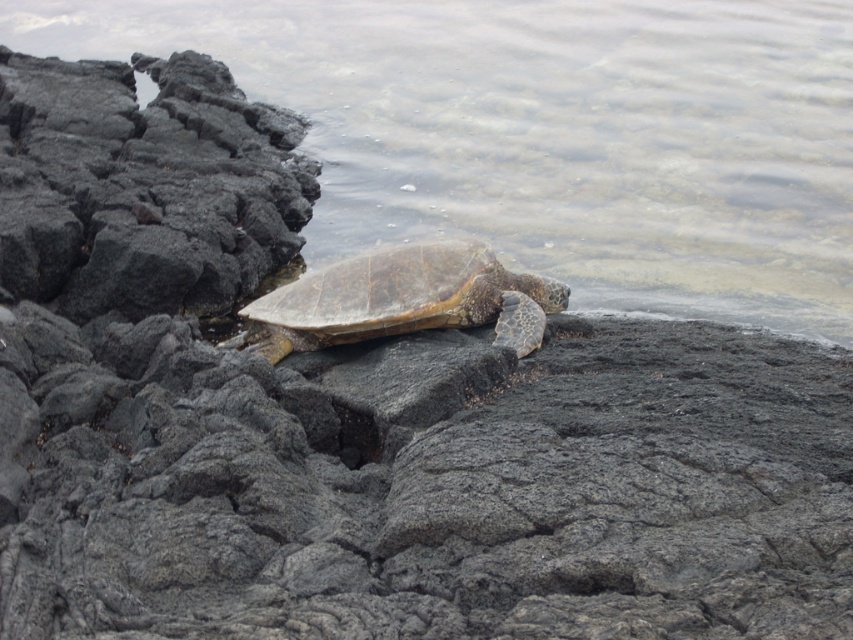
You are a small frog trying to jump from the brown textured shell at center to the clear water at upper center. Can you safely make the jump without getting wet?

The clear water at upper center might be wider than the brown textured shell at center, so the distance between them could be too large for the frog to jump safely. It might need to find a closer spot to jump from.

You are navigating a small drone that can only move forward and backward along a straight path. You need to fly from point A to point B. If point A is at point [606,49] and point B is at point [430,317], will you pass over the turtle resting on the rocky shoreline?

Point [606,49] is behind point [430,317], so the drone will pass over the turtle resting on the rocky shoreline because the turtle is located between the two points along the path.